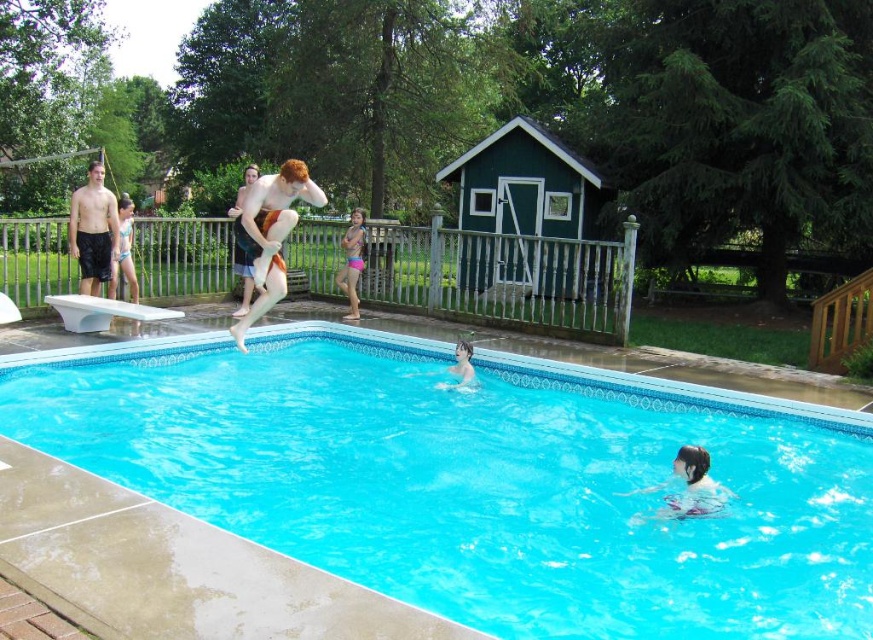
You are standing at the edge of the pool and want to see the blue glossy water at center and the smooth skin man at upper center. Which one is closer to your left side?

The smooth skin man at upper center is closer to your left side because the blue glossy water at center is located to the right of him.

From the picture: You are a photographer trying to capture the scene of the blue glossy water at center and the smooth tan skin at upper center. Which object is positioned higher in the image?

The smooth tan skin at upper center is positioned higher in the image than the blue glossy water at center.

You are planning to place a floating raft in the pool. The raft requires a space wider than the blue glossy water at center. Can you determine if the smooth skin man at upper center is standing in an area where the pool is wide enough to accommodate the raft?

The blue glossy water at center has a lesser width compared to smooth skin man at upper center. Since the smooth skin man at upper center is in an area where the pool is wider than the blue glossy water at center, the raft can be placed there as it requires a space wider than the blue glossy water at center.